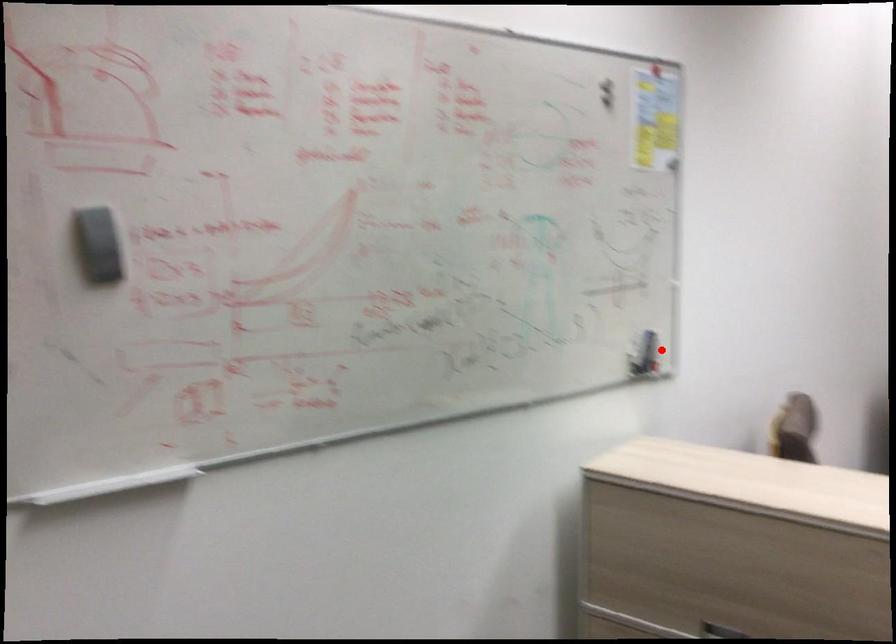
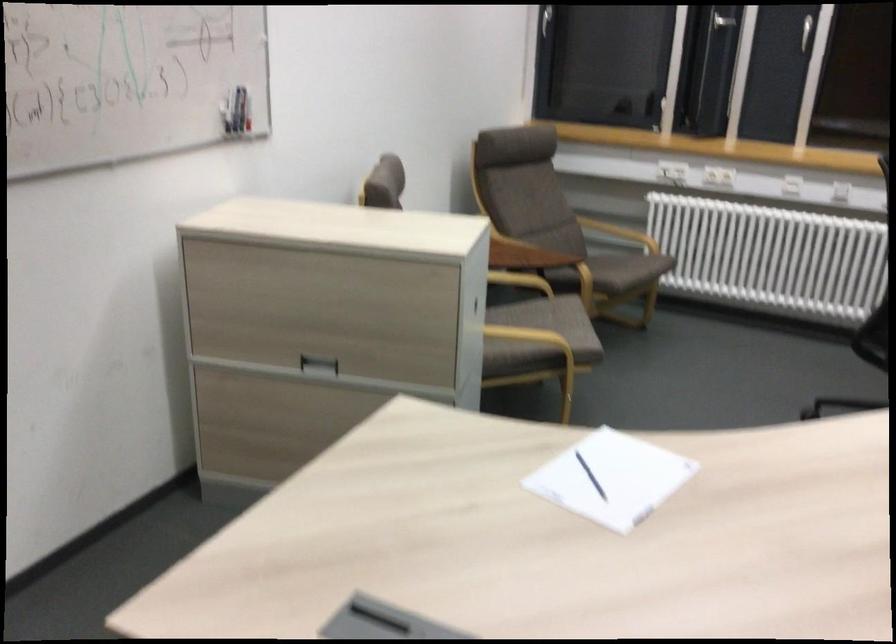
Locate, in the second image, the point that corresponds to the highlighted location in the first image.

(248, 114)